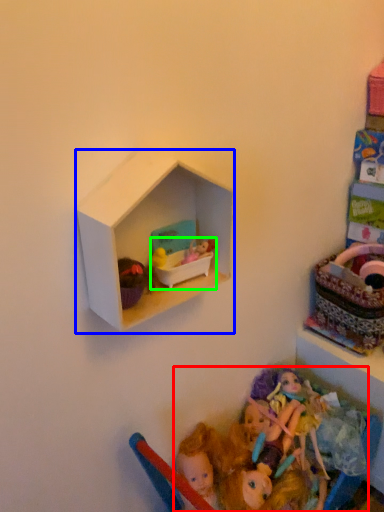
Question: Based on their relative distances, which object is farther from doll (highlighted by a red box)? Choose from shelf (highlighted by a blue box) and toy (highlighted by a green box).

Choices:
 (A) shelf
 (B) toy

Answer: (A)